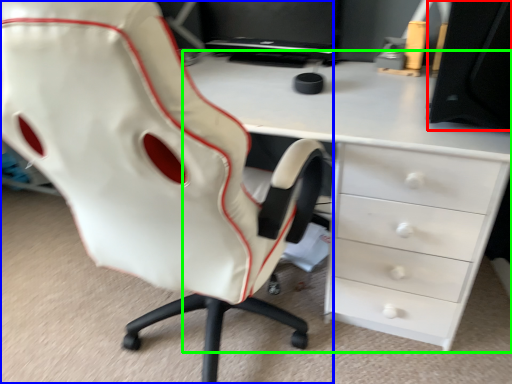
Question: Which is nearer to the desktop (highlighted by a red box)? chair (highlighted by a blue box) or desk (highlighted by a green box).

Choices:
 (A) chair
 (B) desk

Answer: (B)